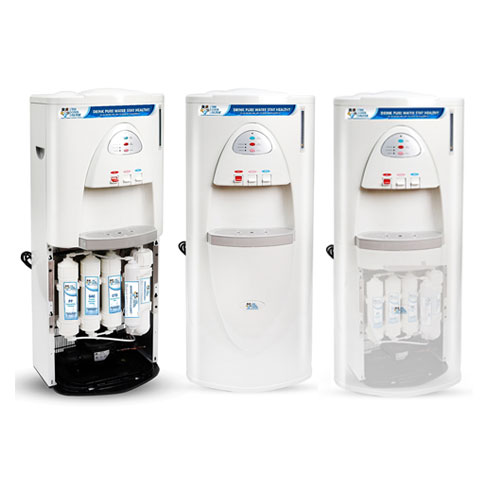
You are a GUI agent. You are given a task and a screenshot of the screen. Output one action in this format:
    pyautogui.click(x=<x>, y=<y>)
    Task: Click on the white switch
    
    Given the screenshot: What is the action you would take?
    pyautogui.click(x=126, y=181), pyautogui.click(x=138, y=179), pyautogui.click(x=249, y=179), pyautogui.click(x=260, y=179), pyautogui.click(x=402, y=182), pyautogui.click(x=418, y=182)